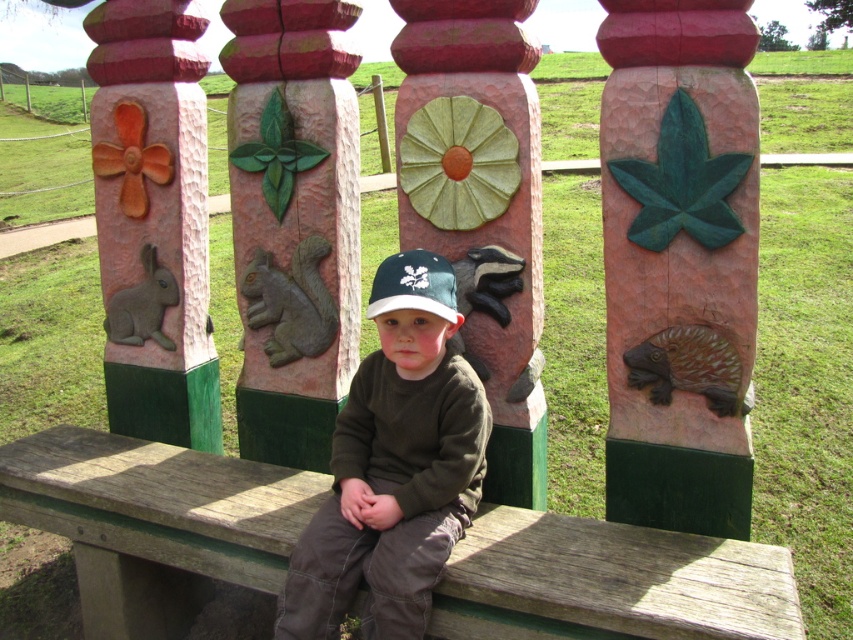
Question: Among these objects, which one is farthest from the camera?

Choices:
 (A) wooden bench at center
 (B) carved stone squirrel at center

Answer: (B)

Question: Can you confirm if green stone squirrel at center is positioned to the right of brown matte hedgehog at center?

Choices:
 (A) yes
 (B) no

Answer: (B)

Question: Can you confirm if green matte leaf at upper right is bigger than carved stone squirrel at center?

Choices:
 (A) no
 (B) yes

Answer: (B)

Question: Can you confirm if brown textured hedgehog at right is positioned to the right of green matte baseball cap at center?

Choices:
 (A) yes
 (B) no

Answer: (A)

Question: Which object is positioned farthest from the green stone squirrel at center?

Choices:
 (A) carved stone squirrel at center
 (B) matte gray rabbit at left

Answer: (B)

Question: Which of the following is the closest to the observer?

Choices:
 (A) (753, 284)
 (B) (634, 566)

Answer: (B)